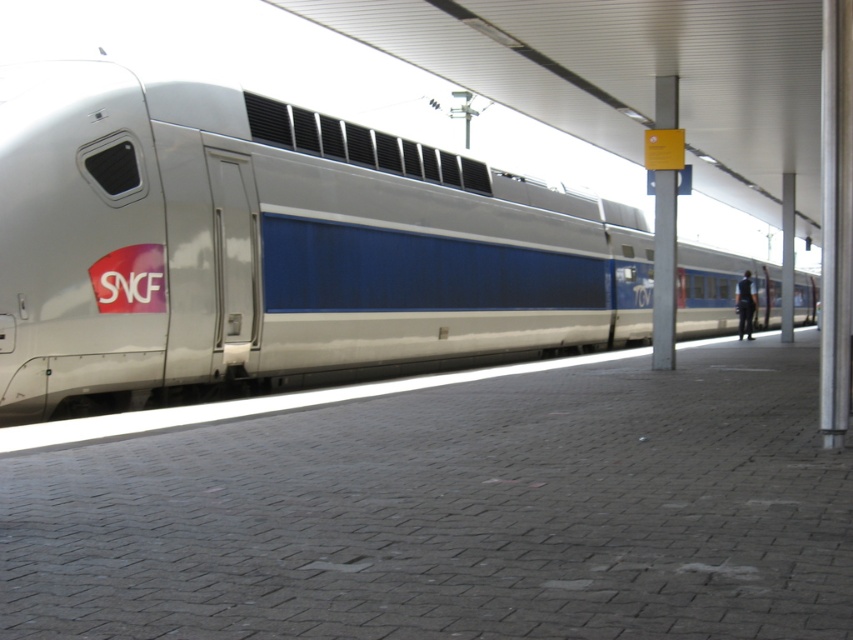
Question: Considering the relative positions of white glossy train at center and black fabric person at right in the image provided, where is white glossy train at center located with respect to black fabric person at right?

Choices:
 (A) below
 (B) above

Answer: (B)

Question: Which point is closer to the camera taking this photo?

Choices:
 (A) (363, 352)
 (B) (741, 298)

Answer: (A)

Question: In this image, where is white glossy train at center located relative to black fabric person at right?

Choices:
 (A) right
 (B) left

Answer: (B)

Question: Is white glossy train at center behind black fabric person at right?

Choices:
 (A) yes
 (B) no

Answer: (B)